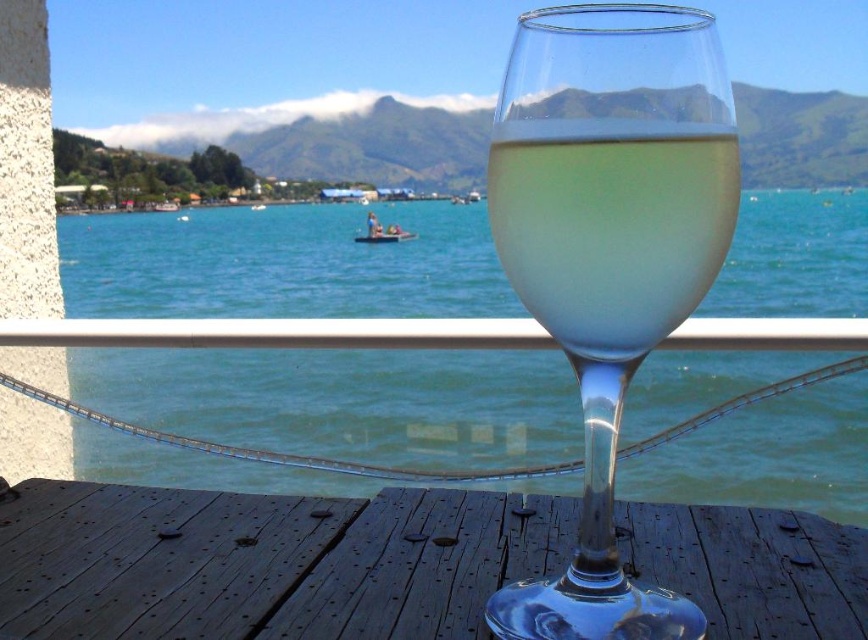
Question: Is transparent glass at center below clear glass wine glass at center?

Choices:
 (A) no
 (B) yes

Answer: (B)

Question: Can you confirm if clear glass wine glass at center is positioned below translucent glass wine at center?

Choices:
 (A) yes
 (B) no

Answer: (A)

Question: Which of the following is the closest to the observer?

Choices:
 (A) translucent glass wine at center
 (B) clear glass wine glass at center
 (C) transparent glass at center

Answer: (B)

Question: Can you confirm if transparent water at center is bigger than transparent glass at center?

Choices:
 (A) yes
 (B) no

Answer: (A)

Question: Which point is farther to the camera?

Choices:
 (A) (189, 573)
 (B) (207, 291)
 (C) (651, 49)

Answer: (B)

Question: Which object is farther from the camera taking this photo?

Choices:
 (A) clear glass wine glass at center
 (B) transparent water at center
 (C) translucent glass wine at center

Answer: (B)